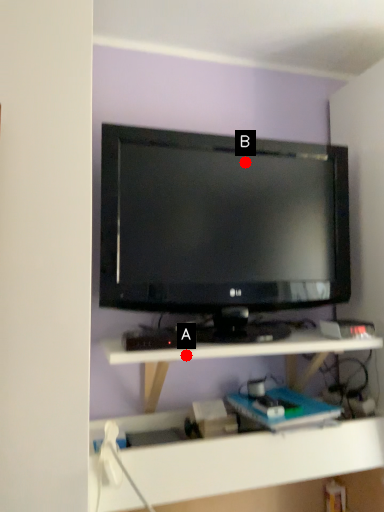
Question: Two points are circled on the image, labeled by A and B beside each circle. Among these points, which one is nearest to the camera?

Choices:
 (A) A is closer
 (B) B is closer

Answer: (A)